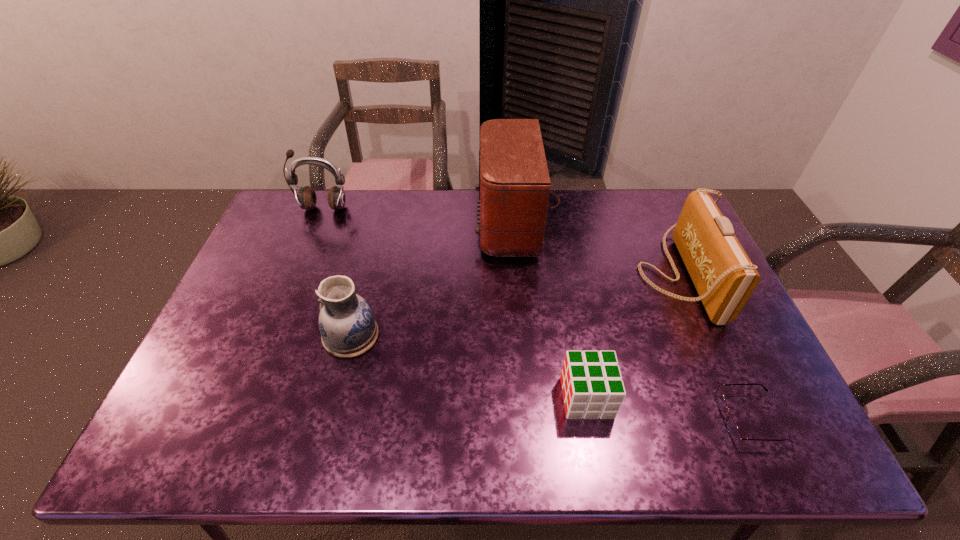
You are a GUI agent. You are given a task and a screenshot of the screen. Output one action in this format:
    pyautogui.click(x=<x>, y=<y>)
    Task: Click on the free space between the pottery and the leftmost object
    The height and width of the screenshot is (540, 960).
    Given the screenshot: What is the action you would take?
    pyautogui.click(x=337, y=272)

Find the location of `vacant area between the handbag and the tallest object`. vacant area between the handbag and the tallest object is located at coordinates (600, 249).

Where is `unoccupied area between the radio receiver and the spectacles`? The width and height of the screenshot is (960, 540). unoccupied area between the radio receiver and the spectacles is located at coordinates (636, 321).

Select which object appears as the third closest to the radio receiver. Please provide its 2D coordinates. Your answer should be formatted as a tuple, i.e. [(x, y)], where the tuple contains the x and y coordinates of a point satisfying the conditions above.

[(592, 384)]

Find the location of a particular element. The height and width of the screenshot is (540, 960). object that stands as the second closest to the handbag is located at coordinates (732, 428).